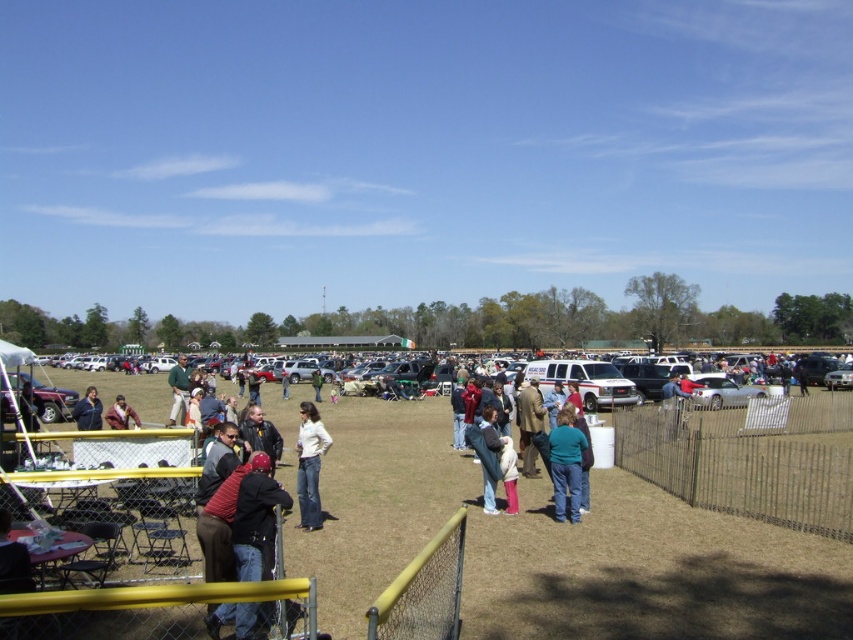
You are organizing a photo shoot and need to arrange two models wearing the white matte shirt at center and the green fabric shirt at center. The photographer wants the thinner model to stand closer to the yellow metal railing for better lighting. Which shirt should be placed closer to the yellow metal railing?

The white matte shirt at center is thinner than the green fabric shirt at center, so the model wearing the white matte shirt at center should be placed closer to the yellow metal railing.

You are standing at the entrance of the field and want to locate the person wearing the white matte shirt at center. Which direction should you look to find them?

The white matte shirt at center is located at point 0.727 on the x axis and 0.363 on the y axis, so you should look towards the center of the image to find them.